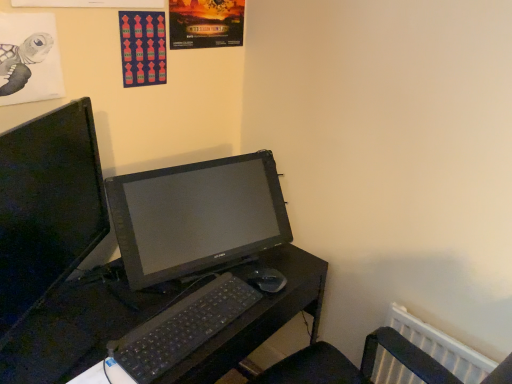
This screenshot has width=512, height=384. Find the location of `vacant space behind black plastic mouse at lower center`. vacant space behind black plastic mouse at lower center is located at coordinates (261, 260).